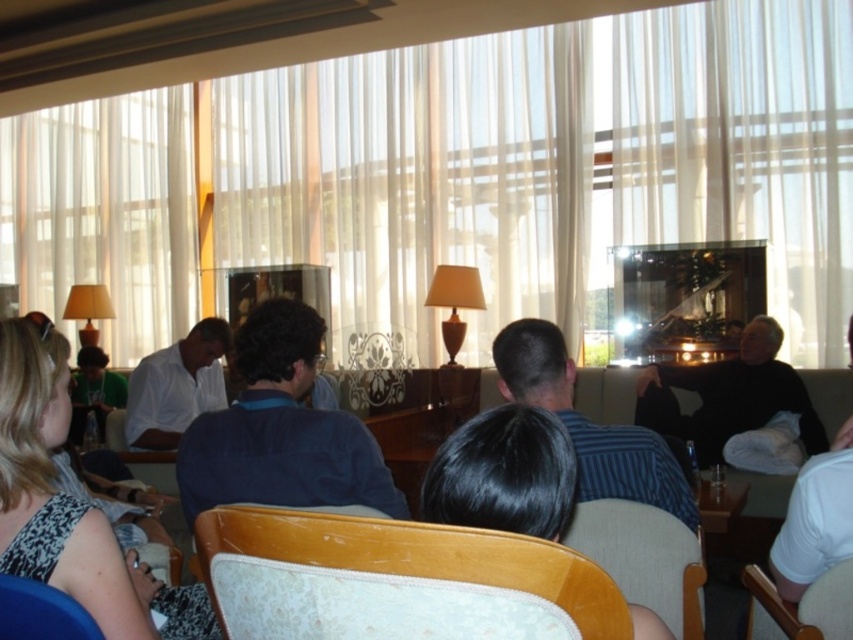
You are a photographer taking a picture of the scene. You notice the white matte shirt at center and the wooden chair at lower right. Which object is positioned higher in the image?

The white matte shirt at center is located above the wooden chair at lower right, so it is positioned higher in the image.

You are a photographer trying to capture a candid shot of the dark blue striped shirt at center and the black matte sweater at right. To ensure both are in frame, you need to know their positions relative to each other. Which object is positioned to the left of the other?

The dark blue striped shirt at center is to the left of the black matte sweater at right.